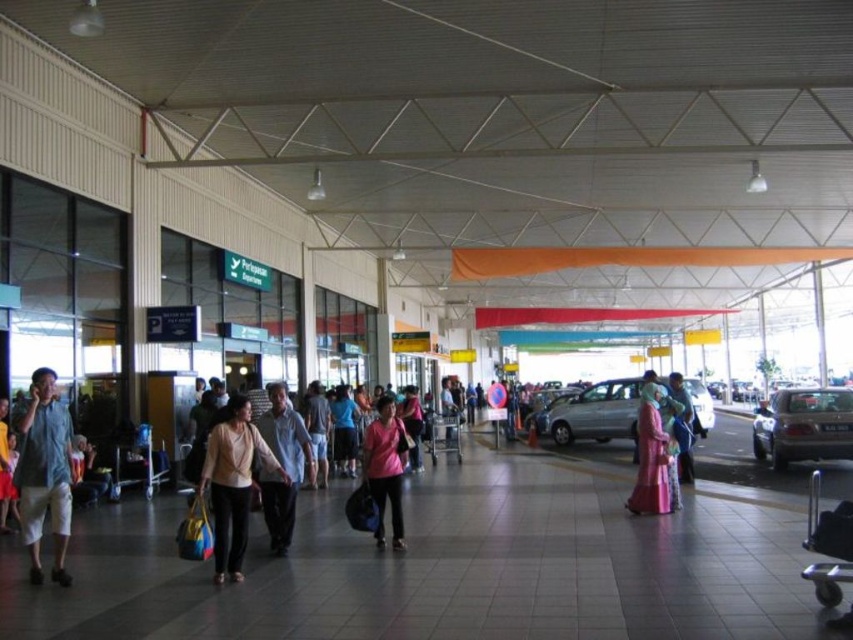
Question: Can you confirm if pink matte shirt at center is positioned below pink fabric bag at center?

Choices:
 (A) yes
 (B) no

Answer: (B)

Question: Estimate the real-world distances between objects in this image. Which object is farther from the light brown cotton shirt at center?

Choices:
 (A) light blue denim shorts at center
 (B) matte pink dress at center

Answer: (B)

Question: Which point is farther to the camera?

Choices:
 (A) (252, 433)
 (B) (393, 531)
 (C) (792, 442)

Answer: (C)

Question: Does matte beige sweater at center appear under matte pink dress at center?

Choices:
 (A) no
 (B) yes

Answer: (B)

Question: Does silver metallic car at center have a greater width compared to matte pink dress at center?

Choices:
 (A) yes
 (B) no

Answer: (A)

Question: Which is nearer to the denim shorts at left?

Choices:
 (A) matte beige shirt at center
 (B) pink satin dress at center

Answer: (A)